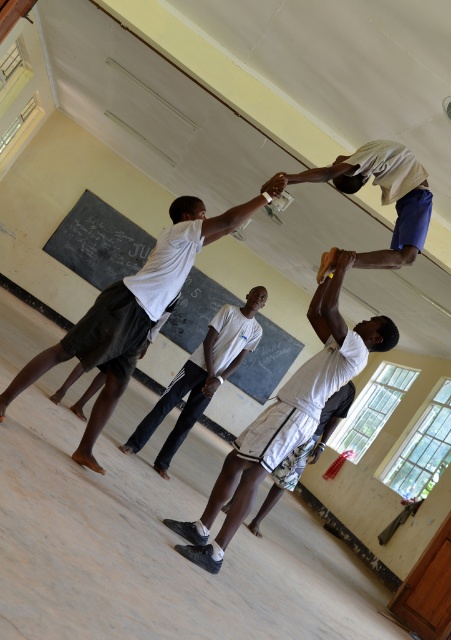
Who is higher up, white matte shirt at upper center or white cotton shirt at center?

Positioned higher is white matte shirt at upper center.

Which is behind, point (386, 252) or point (224, 305)?

Positioned behind is point (224, 305).

Identify the location of white matte shirt at upper center. Image resolution: width=451 pixels, height=640 pixels. click(383, 195).

Identify the location of white matte shirt at upper center. The height and width of the screenshot is (640, 451). (383, 195).

Is white matte basketball at center thinner than white cotton shirt at center?

Incorrect, white matte basketball at center's width is not less than white cotton shirt at center's.

Does point (274, 296) come in front of point (171, 440)?

No, (274, 296) is behind (171, 440).

Is point (27, 145) positioned before point (189, 364)?

No, it is behind (189, 364).

Where is `white matte basketball at center`? This screenshot has width=451, height=640. white matte basketball at center is located at coordinates (65, 208).

Which is behind, point (110, 252) or point (248, 296)?

The point (110, 252) is behind.

Which is in front, point (113, 234) or point (169, 392)?

Point (169, 392) is more forward.

Is point (82, 269) closer to viewer compared to point (217, 346)?

No, (82, 269) is further to viewer.

Identify the location of black chalkboard at upper center. (99, 241).